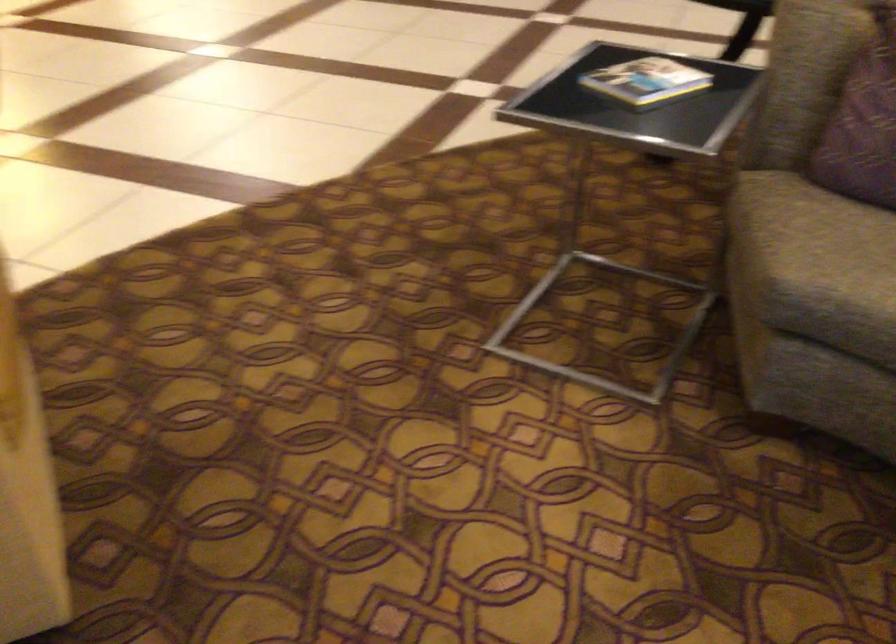
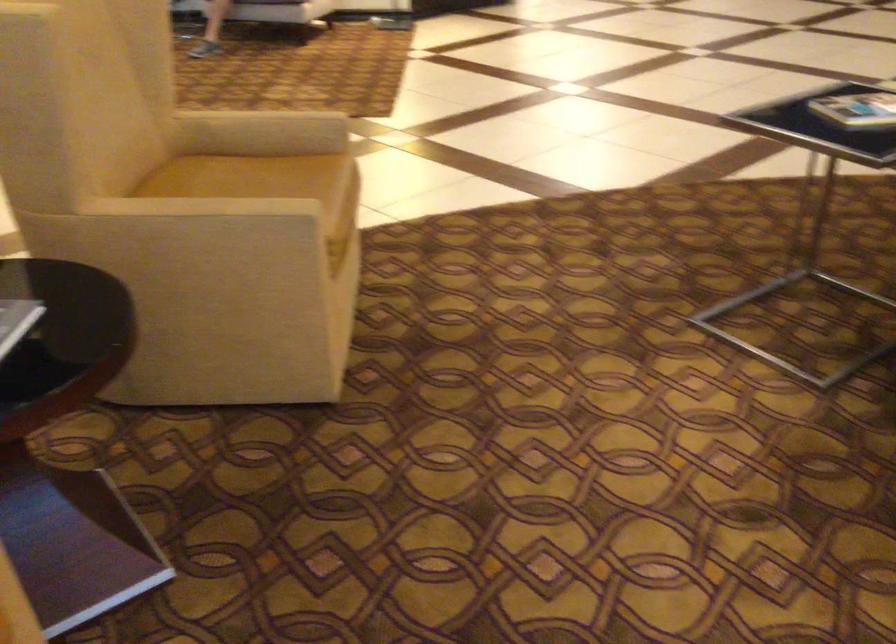
Question: The first image is from the beginning of the video and the second image is from the end. How did the camera likely rotate when shooting the video?

Choices:
 (A) Left
 (B) Right
 (C) Up
 (D) Down

Answer: (A)